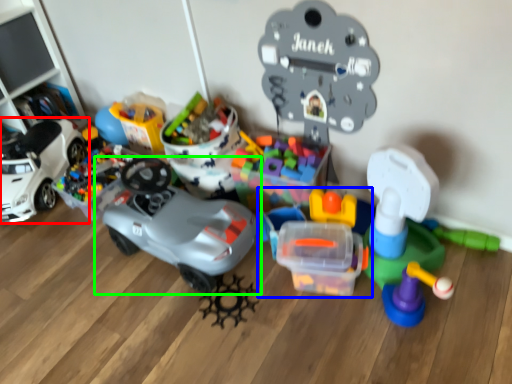
Question: Based on their relative distances, which object is nearer to car (highlighted by a red box)? Choose from toy (highlighted by a blue box) and toy (highlighted by a green box).

Choices:
 (A) toy
 (B) toy

Answer: (B)